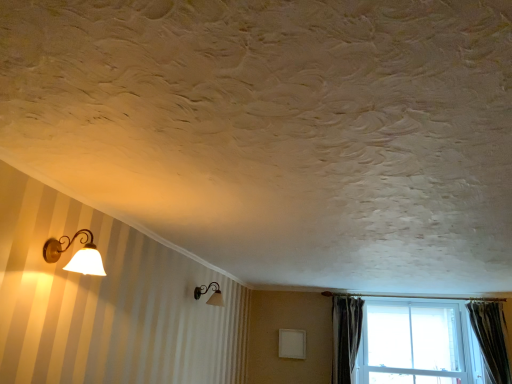
Question: Is white glass window at lower right positioned before green textured curtain at right, the 1th curtain viewed from the right?

Choices:
 (A) no
 (B) yes

Answer: (A)

Question: From the image's perspective, is white glass window at lower right located beneath green textured curtain at right, the 2th curtain in the left-to-right sequence?

Choices:
 (A) no
 (B) yes

Answer: (B)

Question: Is green textured curtain at right, the 2th curtain in the left-to-right sequence, at the back of white glass window at lower right?

Choices:
 (A) no
 (B) yes

Answer: (A)

Question: Does white glass window at lower right have a smaller size compared to green textured curtain at right, the 1th curtain viewed from the right?

Choices:
 (A) no
 (B) yes

Answer: (A)

Question: Is white glass window at lower right outside green textured curtain at right, the 1th curtain viewed from the right?

Choices:
 (A) no
 (B) yes

Answer: (B)

Question: From a real-world perspective, is matte gold wall sconce at left, the second lamp when ordered from back to front, physically located above or below matte glass lamp at upper left, the second lamp from the front?

Choices:
 (A) below
 (B) above

Answer: (A)

Question: Is matte gold wall sconce at left, which is the 1th lamp in left-to-right order, bigger or smaller than matte glass lamp at upper left, the second lamp from the front?

Choices:
 (A) small
 (B) big

Answer: (A)

Question: Considering the relative positions of matte gold wall sconce at left, which is the 1th lamp in left-to-right order, and matte glass lamp at upper left, arranged as the second lamp when viewed from the left, in the image provided, is matte gold wall sconce at left, which is the 1th lamp in left-to-right order, to the left or to the right of matte glass lamp at upper left, arranged as the second lamp when viewed from the left,?

Choices:
 (A) left
 (B) right

Answer: (A)

Question: Considering the positions of matte gold wall sconce at left, the second lamp when ordered from back to front, and matte glass lamp at upper left, which is the 1th lamp from bottom to top, in the image, is matte gold wall sconce at left, the second lamp when ordered from back to front, taller or shorter than matte glass lamp at upper left, which is the 1th lamp from bottom to top,?

Choices:
 (A) short
 (B) tall

Answer: (A)

Question: Considering the positions of point (350, 377) and point (89, 271), is point (350, 377) closer or farther from the camera than point (89, 271)?

Choices:
 (A) farther
 (B) closer

Answer: (A)

Question: From their relative heights in the image, would you say dark gray velvet curtain at right, which appears as the 1th curtain when viewed from the left, is taller or shorter than matte gold wall sconce at left, which is the 1th lamp in left-to-right order?

Choices:
 (A) short
 (B) tall

Answer: (B)

Question: From a real-world perspective, relative to matte gold wall sconce at left, placed as the 2th lamp when sorted from bottom to top, is dark gray velvet curtain at right, which appears as the 1th curtain when viewed from the left, vertically above or below?

Choices:
 (A) above
 (B) below

Answer: (B)

Question: Choose the correct answer: Is dark gray velvet curtain at right, which appears as the 1th curtain when viewed from the left, inside matte gold wall sconce at left, the second lamp when ordered from back to front, or outside it?

Choices:
 (A) outside
 (B) inside

Answer: (A)

Question: From their relative heights in the image, would you say white glass window at lower right is taller or shorter than dark gray velvet curtain at right, which appears as the 1th curtain when viewed from the left?

Choices:
 (A) tall
 (B) short

Answer: (A)

Question: From the image's perspective, is white glass window at lower right located above or below dark gray velvet curtain at right, placed as the 2th curtain when sorted from right to left?

Choices:
 (A) above
 (B) below

Answer: (B)